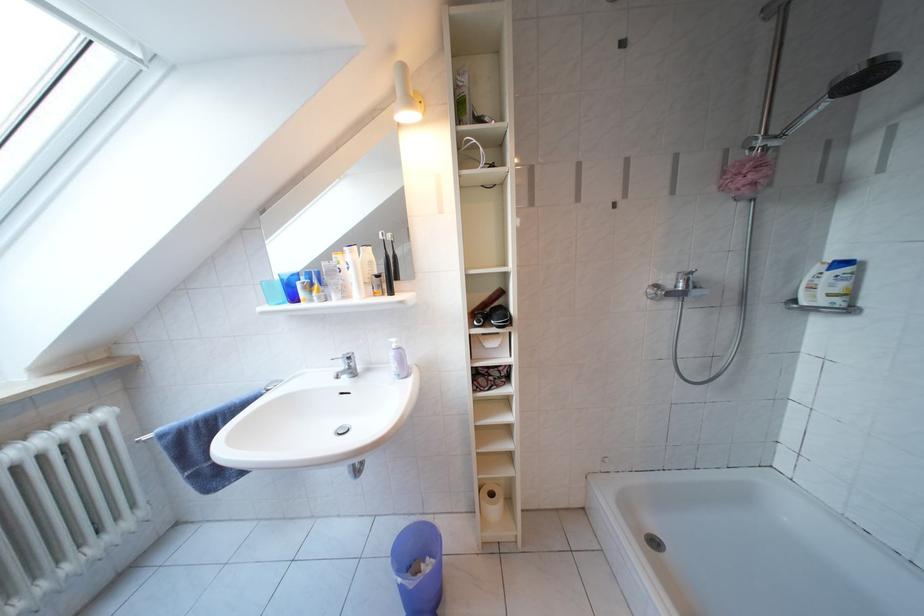
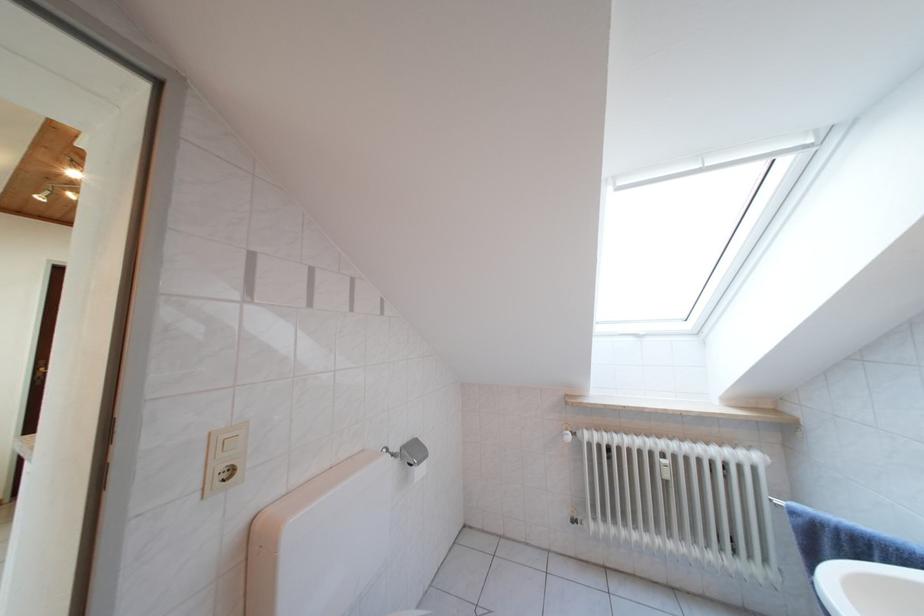
Question: The first image is from the beginning of the video and the second image is from the end. How did the camera likely rotate when shooting the video?

Choices:
 (A) Left
 (B) Right
 (C) Up
 (D) Down

Answer: (A)